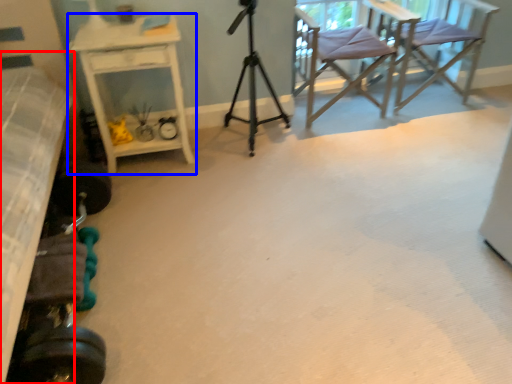
Question: Which point is further to the camera, bed (highlighted by a red box) or desk (highlighted by a blue box)?

Choices:
 (A) bed
 (B) desk

Answer: (B)